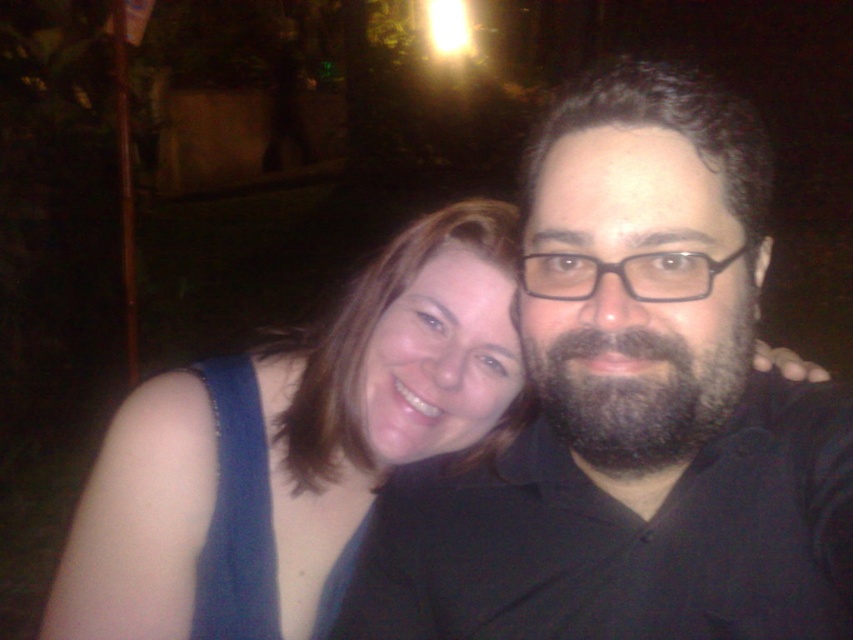
Between blue fabric dress at center and dark brown thick beard at center, which one appears on the right side from the viewer's perspective?

Positioned to the right is dark brown thick beard at center.

Describe the element at coordinates (291, 448) in the screenshot. The height and width of the screenshot is (640, 853). I see `blue fabric dress at center` at that location.

Locate an element on the screen. The width and height of the screenshot is (853, 640). blue fabric dress at center is located at coordinates (291, 448).

The height and width of the screenshot is (640, 853). In order to click on blue fabric dress at center in this screenshot , I will do `click(291, 448)`.

Between dark brown thick beard at center and denim fabric dress at left, which one appears on the right side from the viewer's perspective?

dark brown thick beard at center is more to the right.

Does dark brown thick beard at center have a greater width compared to denim fabric dress at left?

In fact, dark brown thick beard at center might be narrower than denim fabric dress at left.

What do you see at coordinates (637, 381) in the screenshot? The height and width of the screenshot is (640, 853). I see `dark brown thick beard at center` at bounding box center [637, 381].

At what (x,y) coordinates should I click in order to perform the action: click on dark brown thick beard at center. Please return your answer as a coordinate pair (x, y). Looking at the image, I should click on (637, 381).

In the scene shown: Which is more to the left, blue fabric dress at center or denim fabric dress at left?

denim fabric dress at left is more to the left.

Which is behind, point (138, 497) or point (219, 497)?

The point (219, 497) is more distant.

The height and width of the screenshot is (640, 853). What do you see at coordinates (291, 448) in the screenshot?
I see `blue fabric dress at center` at bounding box center [291, 448].

Where is `blue fabric dress at center`? The image size is (853, 640). blue fabric dress at center is located at coordinates (291, 448).